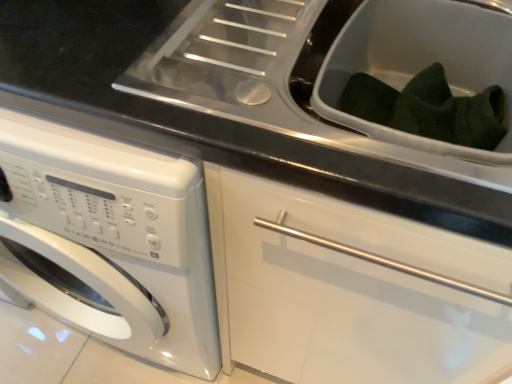
Question: Considering the relative positions of dark green fabric at upper right, which is the first sink from back to front, and white glossy washing machine at left in the image provided, is dark green fabric at upper right, which is the first sink from back to front, to the right of white glossy washing machine at left from the viewer's perspective?

Choices:
 (A) yes
 (B) no

Answer: (A)

Question: Is dark green fabric at upper right, which is the first sink from back to front, next to white glossy washing machine at left?

Choices:
 (A) no
 (B) yes

Answer: (A)

Question: Considering the relative sizes of dark green fabric at upper right, which is the first sink from back to front, and white glossy washing machine at left in the image provided, is dark green fabric at upper right, which is the first sink from back to front, thinner than white glossy washing machine at left?

Choices:
 (A) no
 (B) yes

Answer: (B)

Question: Is dark green fabric at upper right, which is the second sink in front-to-back order, not near white glossy washing machine at left?

Choices:
 (A) yes
 (B) no

Answer: (B)

Question: Does dark green fabric at upper right, which is the first sink from back to front, have a larger size compared to white glossy washing machine at left?

Choices:
 (A) no
 (B) yes

Answer: (A)

Question: Considering the positions of dark green fabric at upper right, which is the first sink from back to front, and white glossy washing machine at left in the image, is dark green fabric at upper right, which is the first sink from back to front, wider or thinner than white glossy washing machine at left?

Choices:
 (A) wide
 (B) thin

Answer: (B)

Question: Relative to white glossy washing machine at left, is dark green fabric at upper right, which is the first sink from back to front, in front or behind?

Choices:
 (A) front
 (B) behind

Answer: (B)

Question: From a real-world perspective, is dark green fabric at upper right, which is the first sink from back to front, positioned above or below white glossy washing machine at left?

Choices:
 (A) above
 (B) below

Answer: (A)

Question: In terms of height, does dark green fabric at upper right, which is the first sink from back to front, look taller or shorter compared to white glossy washing machine at left?

Choices:
 (A) short
 (B) tall

Answer: (A)

Question: Looking at their shapes, would you say white glossy washing machine at left is wider or thinner than white plastic sink at center, marked as the second sink in a back-to-front arrangement?

Choices:
 (A) wide
 (B) thin

Answer: (A)

Question: From a real-world perspective, relative to white plastic sink at center, acting as the 1th sink starting from the front, is white glossy washing machine at left vertically above or below?

Choices:
 (A) above
 (B) below

Answer: (B)

Question: Is white glossy washing machine at left situated inside white plastic sink at center, acting as the 1th sink starting from the front, or outside?

Choices:
 (A) inside
 (B) outside

Answer: (B)

Question: Is white glossy washing machine at left taller or shorter than white plastic sink at center, marked as the second sink in a back-to-front arrangement?

Choices:
 (A) short
 (B) tall

Answer: (B)

Question: Would you say white plastic sink at center, marked as the second sink in a back-to-front arrangement, is inside or outside dark green fabric at upper right, which is the second sink in front-to-back order?

Choices:
 (A) outside
 (B) inside

Answer: (A)

Question: Considering the positions of white plastic sink at center, acting as the 1th sink starting from the front, and dark green fabric at upper right, which is the second sink in front-to-back order, in the image, is white plastic sink at center, acting as the 1th sink starting from the front, wider or thinner than dark green fabric at upper right, which is the second sink in front-to-back order,?

Choices:
 (A) wide
 (B) thin

Answer: (A)